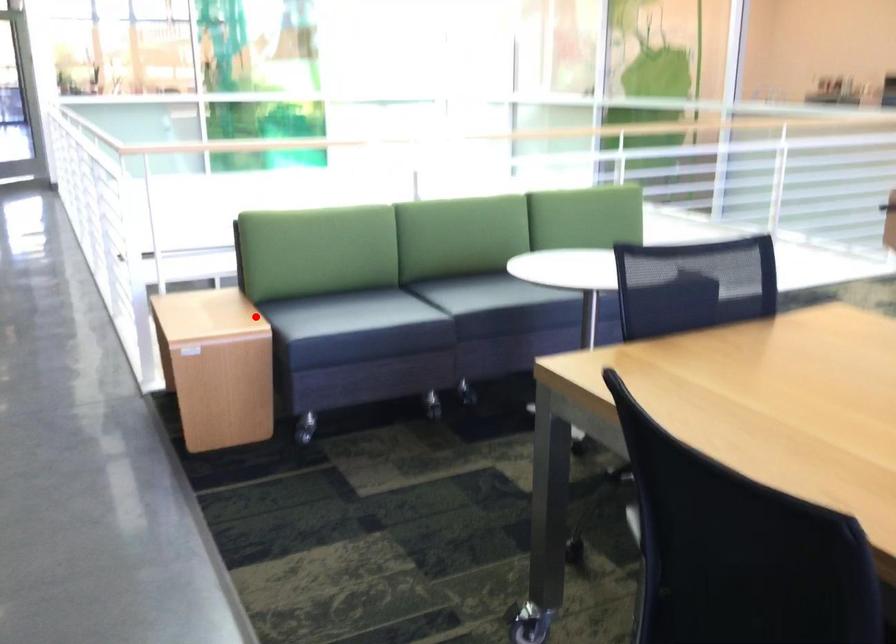
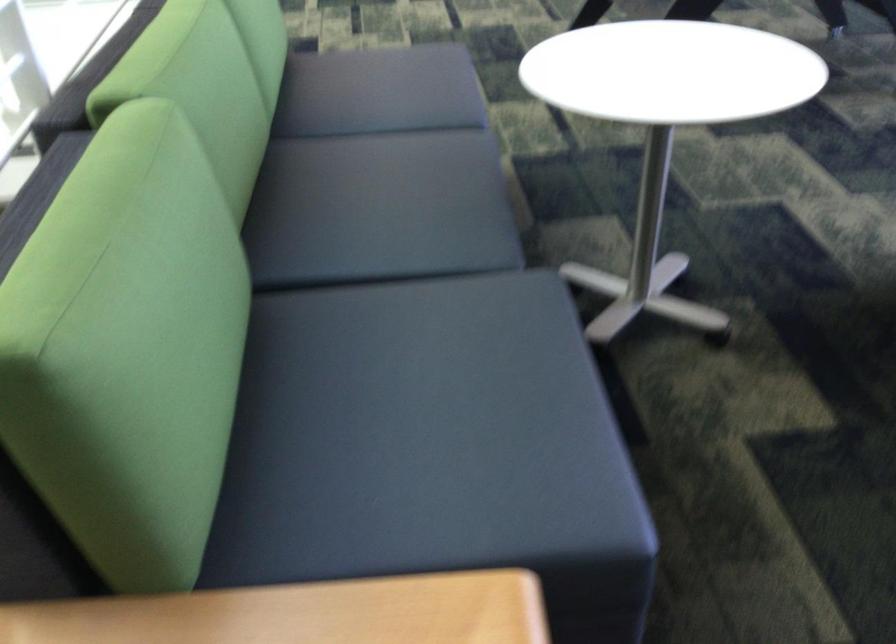
Locate, in the second image, the point that corresponds to the highlighted location in the first image.

(423, 438)